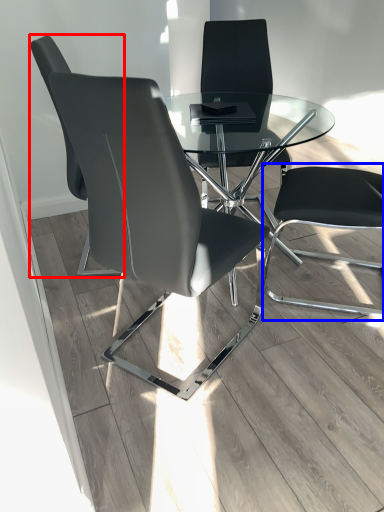
Question: Which object appears closest to the camera in this image, chair (highlighted by a red box) or computer chair (highlighted by a blue box)?

Choices:
 (A) chair
 (B) computer chair

Answer: (B)